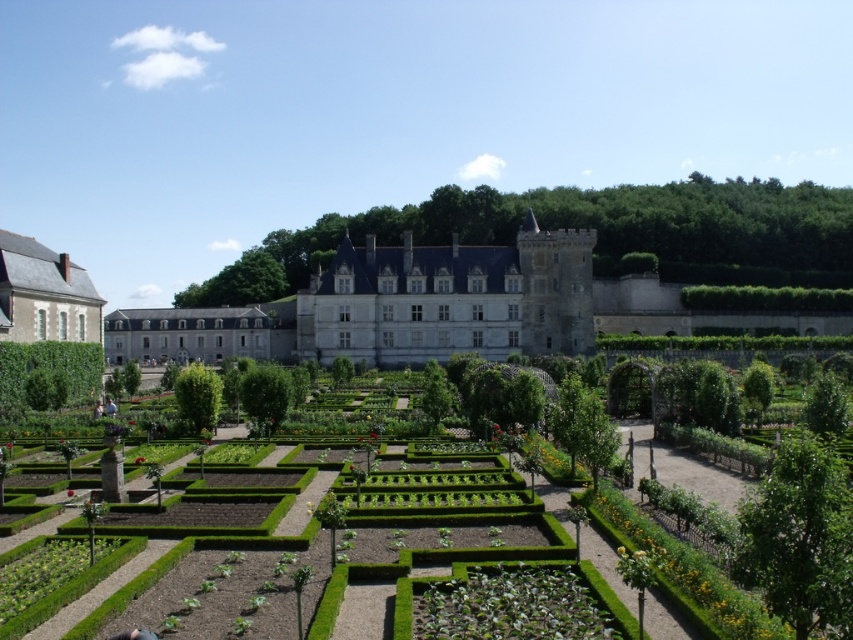
Who is shorter, green grassy bed at center or green leafy hedge at lower left?

Standing shorter between the two is green leafy hedge at lower left.

Can you confirm if green grassy bed at center is taller than green leafy hedge at lower left?

Yes.

Find the location of `green grassy bed at center`. green grassy bed at center is located at coordinates (433, 492).

Is green grassy bed at center taller than green leafy hedge at right?

Yes.

Locate an element on the screen. The image size is (853, 640). green grassy bed at center is located at coordinates (433, 492).

Locate an element on the screen. green grassy bed at center is located at coordinates (433, 492).

Does green leafy hedge at lower left come in front of green leafy hedge at center?

Yes.

Between green leafy hedge at lower left and green leafy hedge at center, which one is positioned lower?

green leafy hedge at center is below.

Does point (24, 355) lie in front of point (189, 406)?

No, (24, 355) is further to viewer.

Find the location of `green leafy hedge at lower left`. green leafy hedge at lower left is located at coordinates (47, 374).